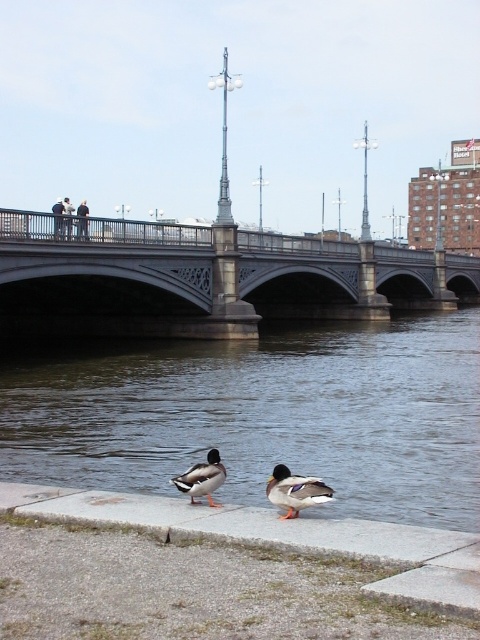
Does stone bridge at center have a greater height compared to gray concrete ledge at lower center?

Correct, stone bridge at center is much taller as gray concrete ledge at lower center.

Does stone bridge at center have a lesser height compared to gray concrete ledge at lower center?

In fact, stone bridge at center may be taller than gray concrete ledge at lower center.

Which is behind, point (237, 308) or point (194, 524)?

The point (237, 308) is behind.

At what (x,y) coordinates should I click in order to perform the action: click on stone bridge at center. Please return your answer as a coordinate pair (x, y). Looking at the image, I should click on (211, 276).

Does gray concrete ledge at lower center have a lesser width compared to dark blue jeans at upper center?

Yes.

Who is lower down, gray concrete ledge at lower center or dark blue jeans at upper center?

gray concrete ledge at lower center is lower down.

Who is more distant from viewer, (130, 513) or (59, 204)?

The point (59, 204) is more distant.

Where is `gray concrete ledge at lower center`? Image resolution: width=480 pixels, height=640 pixels. gray concrete ledge at lower center is located at coordinates (279, 538).

Between stone bridge at center and brown feathered duck at center, which one is positioned lower?

brown feathered duck at center is lower down.

Can you confirm if stone bridge at center is positioned above brown feathered duck at center?

Indeed, stone bridge at center is positioned over brown feathered duck at center.

Find the location of a particular element. The height and width of the screenshot is (640, 480). stone bridge at center is located at coordinates (211, 276).